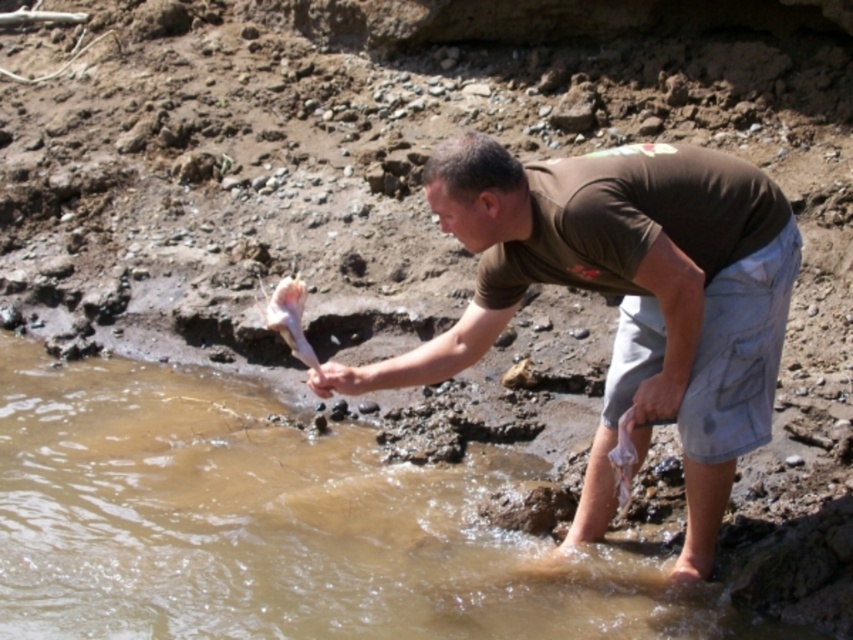
Question: Does brown cotton shirt at center have a lesser width compared to pink flesh at lower left?

Choices:
 (A) yes
 (B) no

Answer: (B)

Question: Is brown cotton shirt at center positioned before pink flesh at lower left?

Choices:
 (A) yes
 (B) no

Answer: (A)

Question: Considering the relative positions of brown cotton shirt at center and pink flesh at lower left in the image provided, where is brown cotton shirt at center located with respect to pink flesh at lower left?

Choices:
 (A) left
 (B) right

Answer: (B)

Question: Which object is closer to the camera taking this photo?

Choices:
 (A) pink flesh at lower left
 (B) brown cotton shirt at center

Answer: (B)